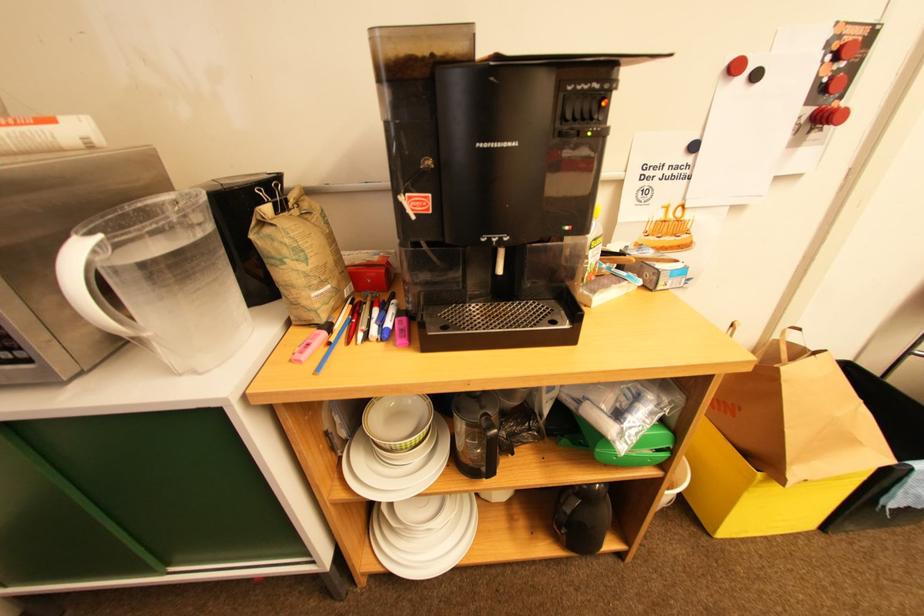
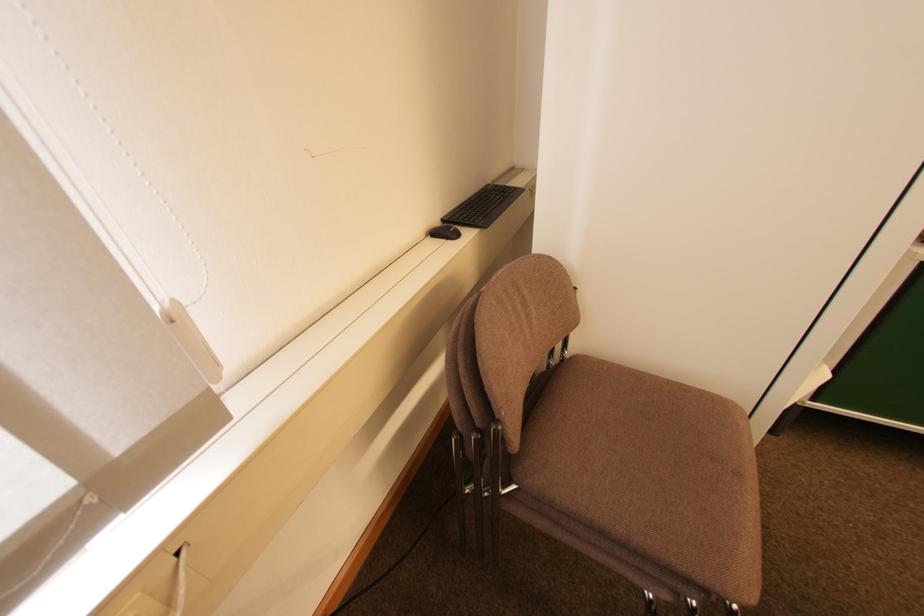
Which direction would the cameraman need to move to produce the second image?

The cameraman moved toward left, backward.